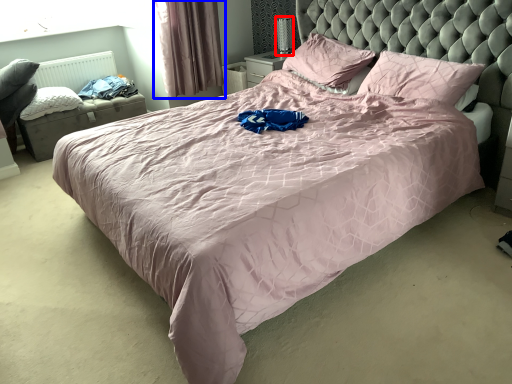
Question: Which object is closer to the camera taking this photo, table lamp (highlighted by a red box) or curtain (highlighted by a blue box)?

Choices:
 (A) table lamp
 (B) curtain

Answer: (B)